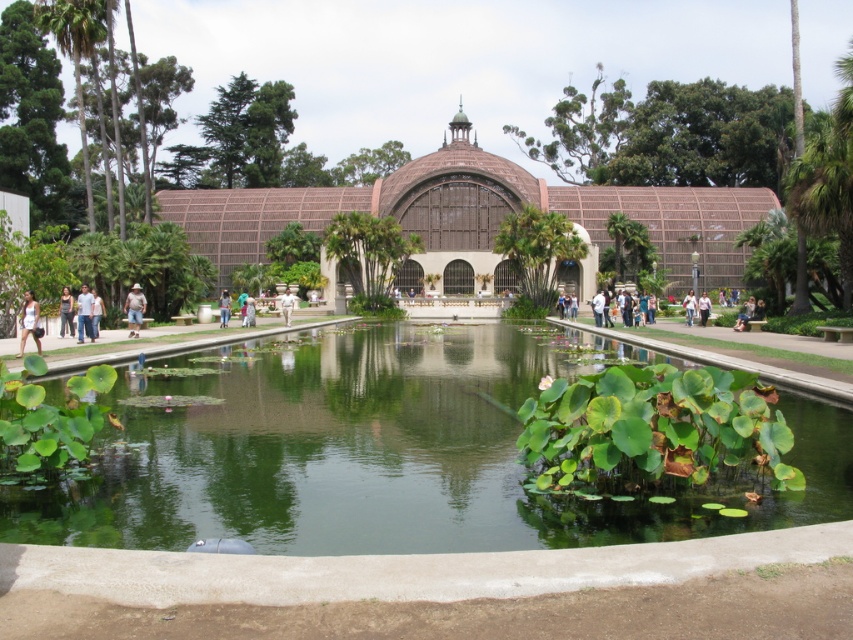
Is point (128, 316) positioned after point (280, 298)?

That is False.

Can you confirm if brown woven hat at center is taller than white cotton shirt at center?

In fact, brown woven hat at center may be shorter than white cotton shirt at center.

Locate an element on the screen. brown woven hat at center is located at coordinates (134, 308).

Locate an element on the screen. brown woven hat at center is located at coordinates (134, 308).

Is green leafy pond at center to the left of brown woven hat at center from the viewer's perspective?

No, green leafy pond at center is not to the left of brown woven hat at center.

Does green leafy pond at center appear on the right side of brown woven hat at center?

Correct, you'll find green leafy pond at center to the right of brown woven hat at center.

What are the coordinates of `green leafy pond at center` in the screenshot? It's located at (387, 451).

Is light blue jeans at left below dark blue jeans at left?

No, light blue jeans at left is not below dark blue jeans at left.

Is light blue jeans at left further to camera compared to dark blue jeans at left?

No.

Which is behind, point (79, 333) or point (73, 301)?

Point (73, 301)

What are the coordinates of `light blue jeans at left` in the screenshot? It's located at (84, 314).